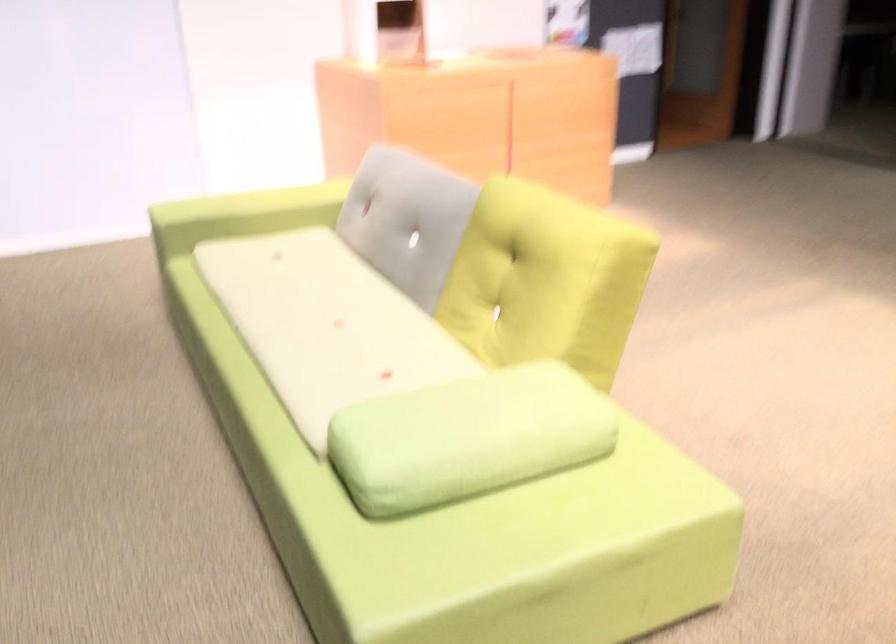
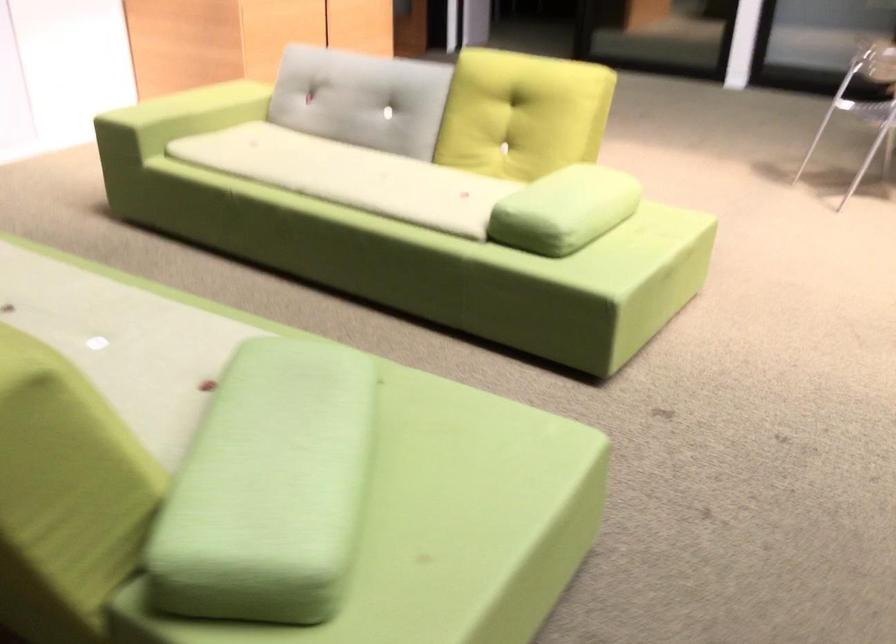
Where in the second image is the point corresponding to (210,221) from the first image?

(178, 117)